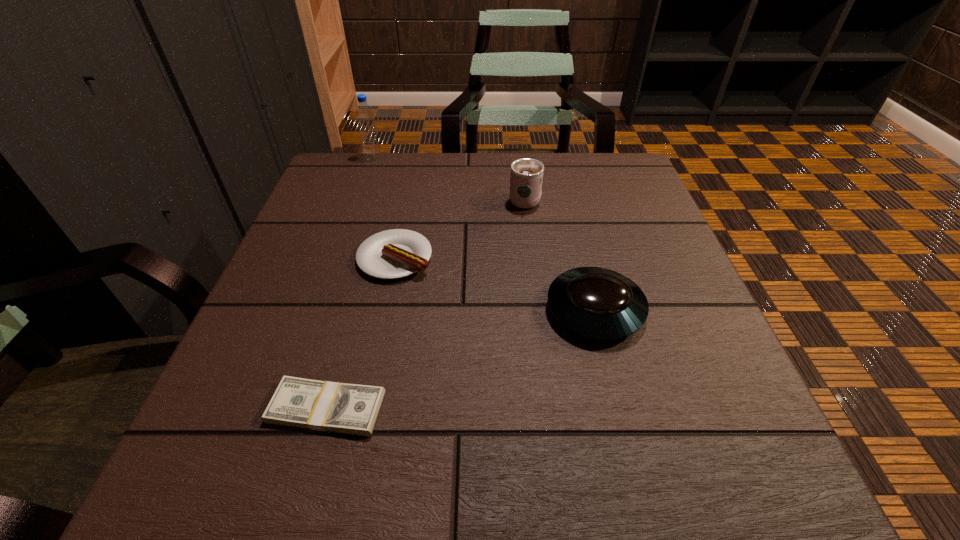
In order to click on the tallest object in this screenshot , I will do `click(364, 114)`.

The height and width of the screenshot is (540, 960). Identify the location of the farthest object. (364, 114).

The width and height of the screenshot is (960, 540). What are the coordinates of `cup` in the screenshot? It's located at (526, 178).

Identify the location of the second farthest object. (526, 178).

You are a GUI agent. You are given a task and a screenshot of the screen. Output one action in this format:
    pyautogui.click(x=<x>, y=<y>)
    Task: Click on the third shortest object
    Image resolution: width=960 pixels, height=540 pixels.
    Given the screenshot: What is the action you would take?
    pyautogui.click(x=598, y=303)

Where is `the second shortest object`? This screenshot has width=960, height=540. the second shortest object is located at coordinates (396, 253).

Where is `dollar`? The height and width of the screenshot is (540, 960). dollar is located at coordinates (345, 408).

Find the location of a particular element. Image resolution: width=960 pixels, height=540 pixels. the shortest object is located at coordinates (345, 408).

Image resolution: width=960 pixels, height=540 pixels. I want to click on free space located 0.090m on the front of the water bottle, so pos(365,180).

Where is `free space located 0.170m on the side with the handle of the cup`? The width and height of the screenshot is (960, 540). free space located 0.170m on the side with the handle of the cup is located at coordinates (518, 152).